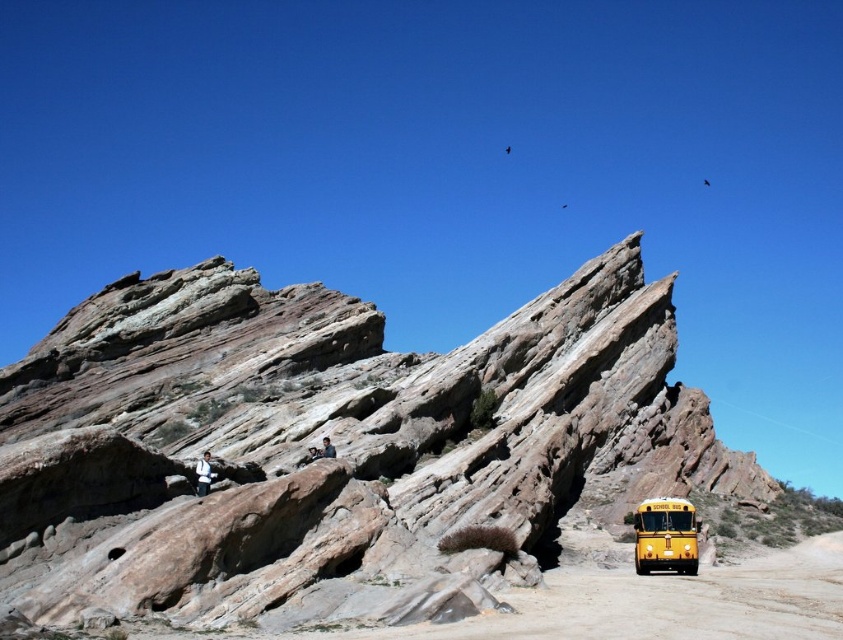
Is rusty rock formation at center to the right of yellow matte school bus at lower right from the viewer's perspective?

No, rusty rock formation at center is not to the right of yellow matte school bus at lower right.

In the scene shown: Is rusty rock formation at center smaller than yellow matte school bus at lower right?

Actually, rusty rock formation at center might be larger than yellow matte school bus at lower right.

Identify the location of rusty rock formation at center. (334, 445).